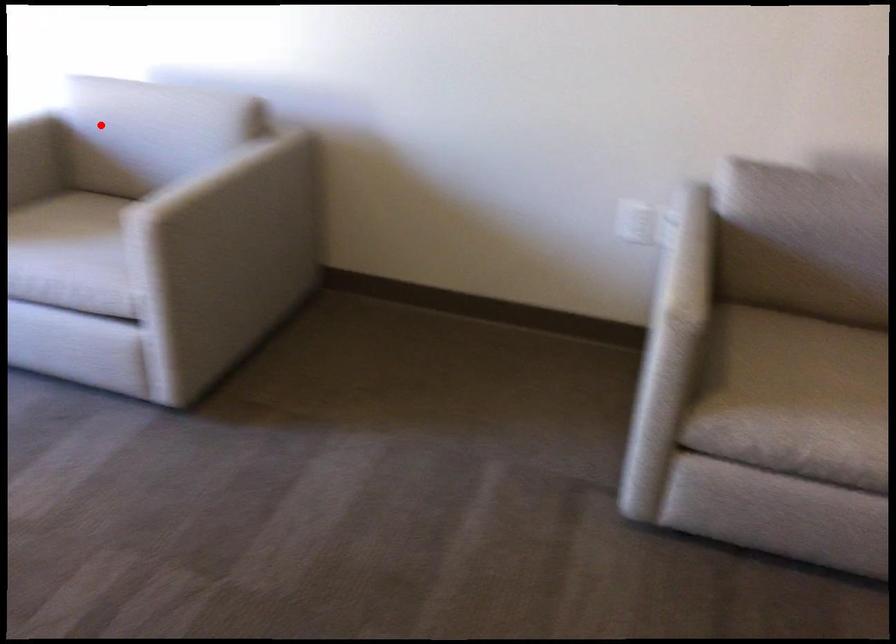
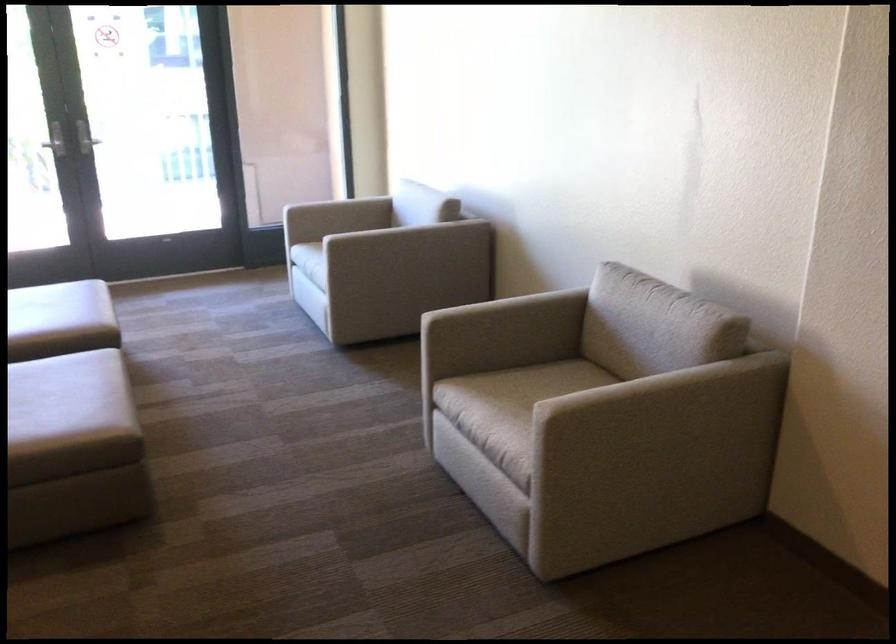
In the second image, find the point that corresponds to the highlighted location in the first image.

(375, 200)